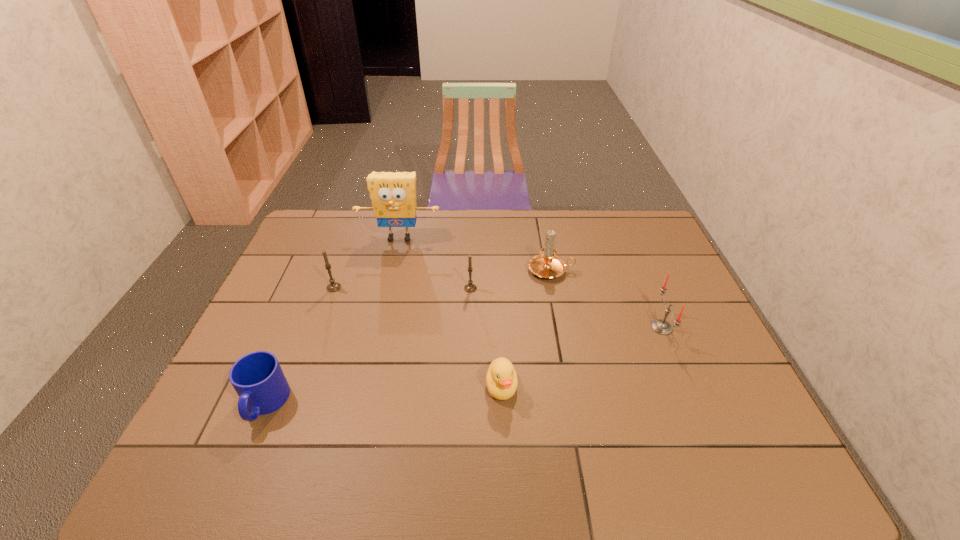
The height and width of the screenshot is (540, 960). I want to click on vacant region located on the front of the third candle from left to right, so click(561, 323).

Identify the location of free space located 0.070m on the front-facing side of the rightmost object. (627, 327).

I want to click on free space located on the front-facing side of the rightmost object, so click(x=526, y=327).

Where is `vacant region located 0.260m on the front-facing side of the rightmost object`? This screenshot has width=960, height=540. vacant region located 0.260m on the front-facing side of the rightmost object is located at coordinates (559, 327).

This screenshot has height=540, width=960. Identify the location of vacant point located 0.180m on the front of the leftmost candle. (316, 337).

What are the coordinates of `vacant space situated 0.200m on the front of the fourth object from right to left` in the screenshot? It's located at (469, 343).

This screenshot has width=960, height=540. In order to click on free region located 0.080m on the side with the handle of the mug in this screenshot , I will do `click(238, 467)`.

Where is `free region located 0.140m on the face of the fifth object from left to right`? free region located 0.140m on the face of the fifth object from left to right is located at coordinates (505, 464).

Where is `object at the far edge`? object at the far edge is located at coordinates tap(393, 195).

The image size is (960, 540). What are the coordinates of `object at the left edge` in the screenshot? It's located at (257, 377).